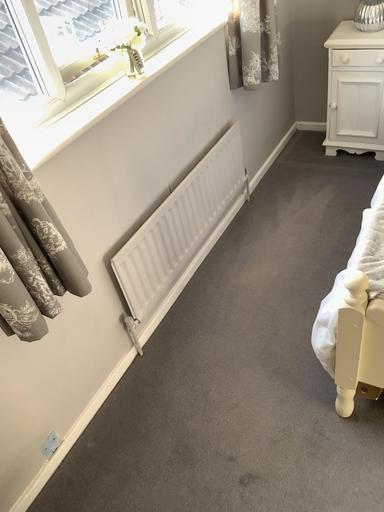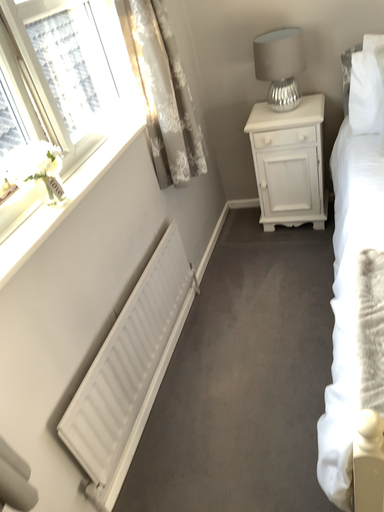
Question: How did the camera likely rotate when shooting the video?

Choices:
 (A) rotated downward
 (B) rotated upward

Answer: (B)